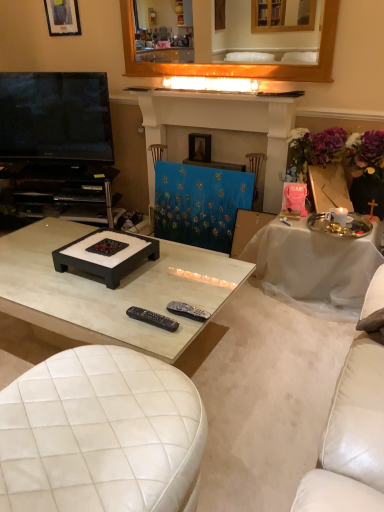
Where is `vacant area that is in front of black plastic remote control at center, which is counted as the first remote control, starting from the left`? vacant area that is in front of black plastic remote control at center, which is counted as the first remote control, starting from the left is located at coordinates (149, 342).